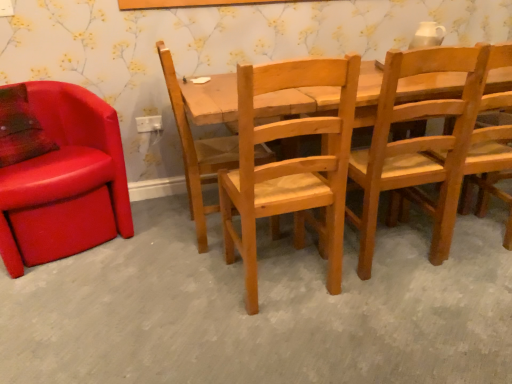
This screenshot has width=512, height=384. I want to click on free location in front of light brown wood chair at right, arranged as the fifth chair when viewed from the left, so click(x=472, y=280).